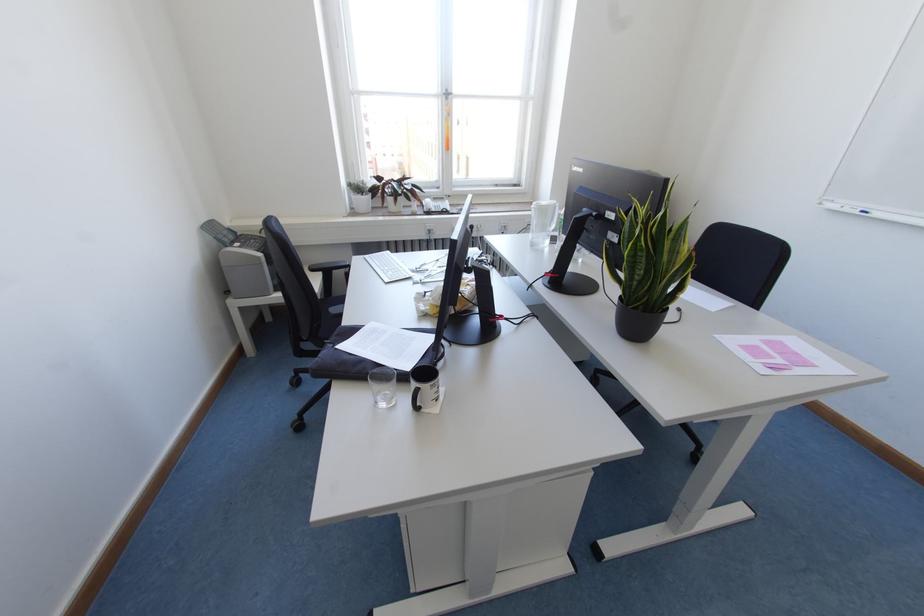
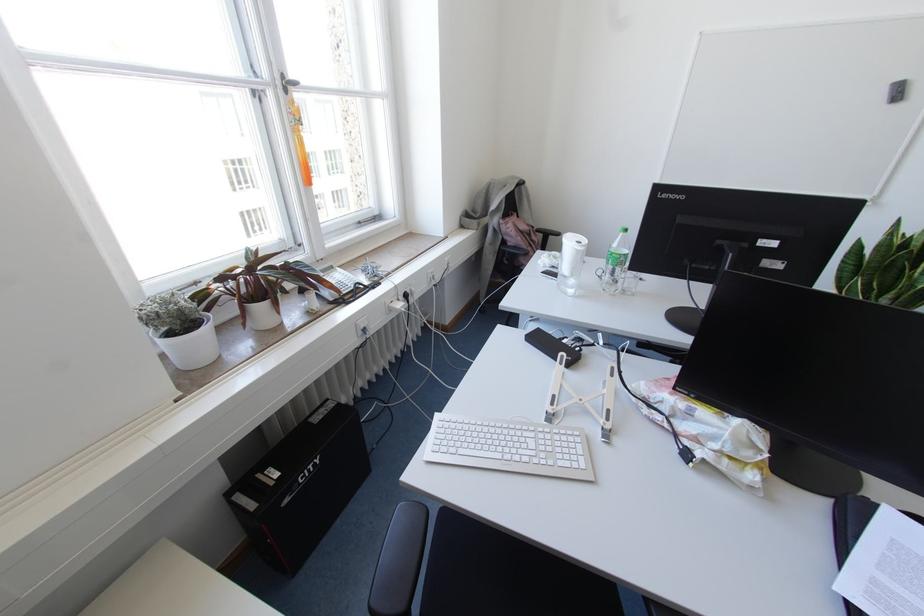
Locate, in the second image, the point that corresponds to pixel 446 98 in the first image.

(285, 90)